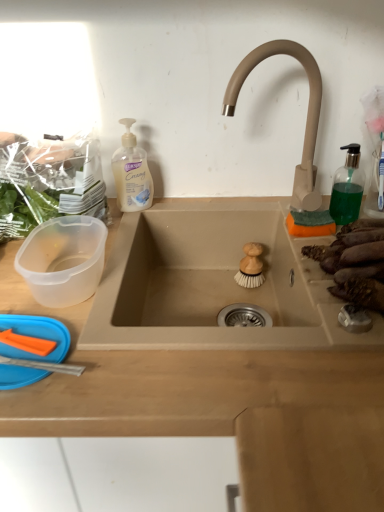
Question: From the image's perspective, is green leafy vegetables at left, which appears as the 1th food when viewed from the left, above or below white creamy liquid soap at upper left?

Choices:
 (A) above
 (B) below

Answer: (B)

Question: Considering the positions of green leafy vegetables at left, placed as the 3th food when sorted from right to left, and white creamy liquid soap at upper left in the image, is green leafy vegetables at left, placed as the 3th food when sorted from right to left, taller or shorter than white creamy liquid soap at upper left?

Choices:
 (A) tall
 (B) short

Answer: (A)

Question: Estimate the real-world distances between objects in this image. Which object is farther from the white creamy liquid soap at upper left?

Choices:
 (A) green leafy vegetables at left, placed as the 3th food when sorted from right to left
 (B) beige wood countertop at center
 (C) green translucent soap dispenser at right
 (D) wooden brush at sink center, which is the 2th food from right to left
 (E) brown matte sweet potatoes at right, acting as the first food starting from the right

Answer: (B)

Question: Estimate the real-world distances between objects in this image. Which object is farther from the beige matte faucet at upper right?

Choices:
 (A) white creamy liquid soap at upper left
 (B) beige wood countertop at center
 (C) wooden brush at sink center, which is the 2th food from right to left
 (D) green translucent soap dispenser at right
 (E) brown matte sweet potatoes at right, which is the third food from left to right

Answer: (B)